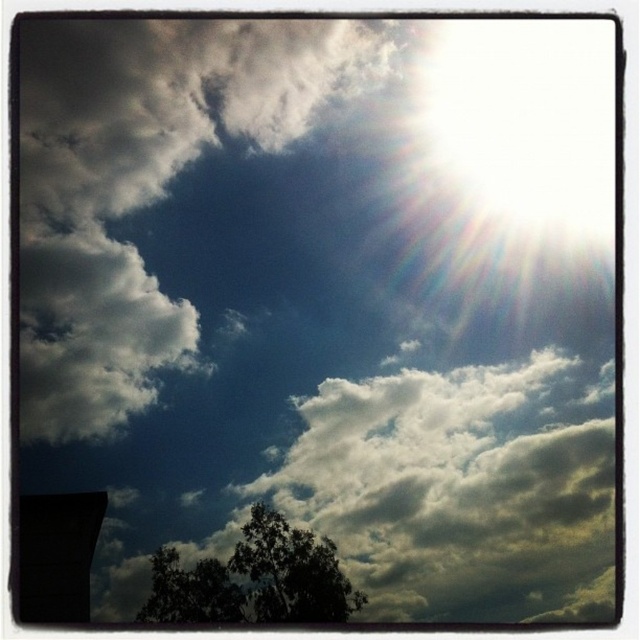
Does white fluffy cloud at upper left appear under dark green leafy tree at lower center?

No.

Which of these two, white fluffy cloud at upper left or dark green leafy tree at lower center, stands shorter?

dark green leafy tree at lower center

Find the location of a particular element. Image resolution: width=640 pixels, height=640 pixels. white fluffy cloud at upper left is located at coordinates (148, 182).

This screenshot has width=640, height=640. I want to click on white fluffy cloud at upper left, so pos(148,182).

Is white fluffy cloud at upper left taller than dark green leafy tree at lower left?

Yes.

Which is above, white fluffy cloud at upper left or dark green leafy tree at lower left?

white fluffy cloud at upper left is above.

Between point (26, 172) and point (180, 566), which one is positioned in front?

Positioned in front is point (180, 566).

This screenshot has height=640, width=640. What are the coordinates of `white fluffy cloud at upper left` in the screenshot? It's located at (148, 182).

Does white fluffy cloud at center appear on the right side of dark green leafy tree at lower left?

Indeed, white fluffy cloud at center is positioned on the right side of dark green leafy tree at lower left.

Can you confirm if white fluffy cloud at center is bigger than dark green leafy tree at lower left?

Indeed, white fluffy cloud at center has a larger size compared to dark green leafy tree at lower left.

Is point (236, 506) more distant than point (164, 588)?

Yes, point (236, 506) is behind point (164, 588).

Where is `white fluffy cloud at center`? white fluffy cloud at center is located at coordinates (449, 486).